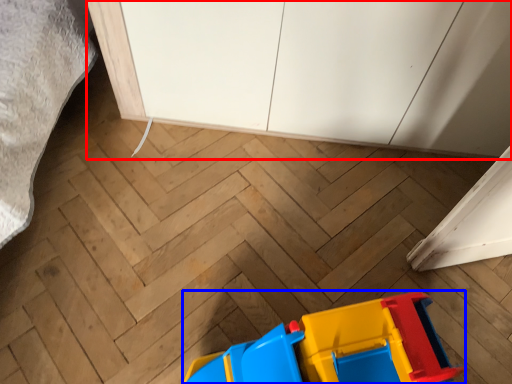
Question: Among these objects, which one is farthest to the camera, cabinetry (highlighted by a red box) or toy (highlighted by a blue box)?

Choices:
 (A) cabinetry
 (B) toy

Answer: (A)